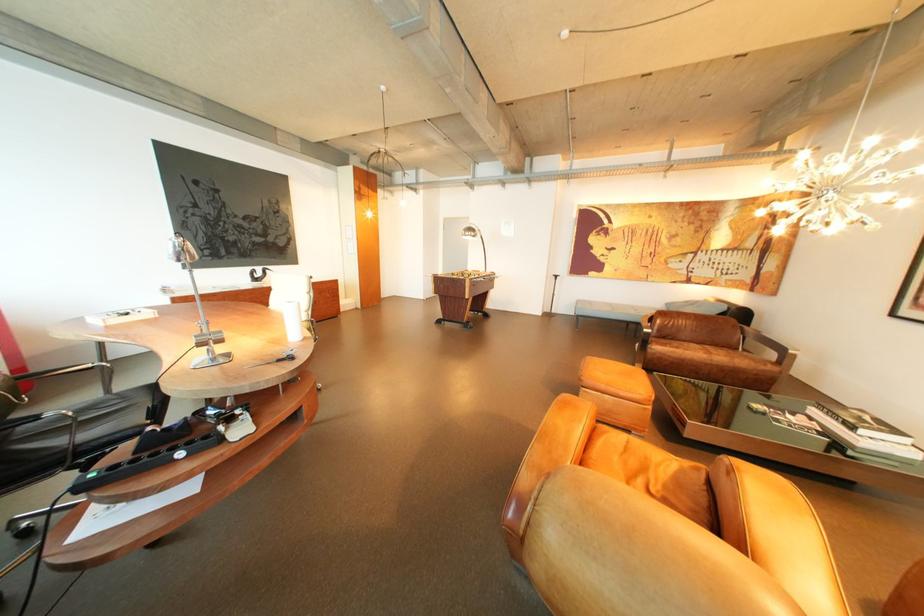
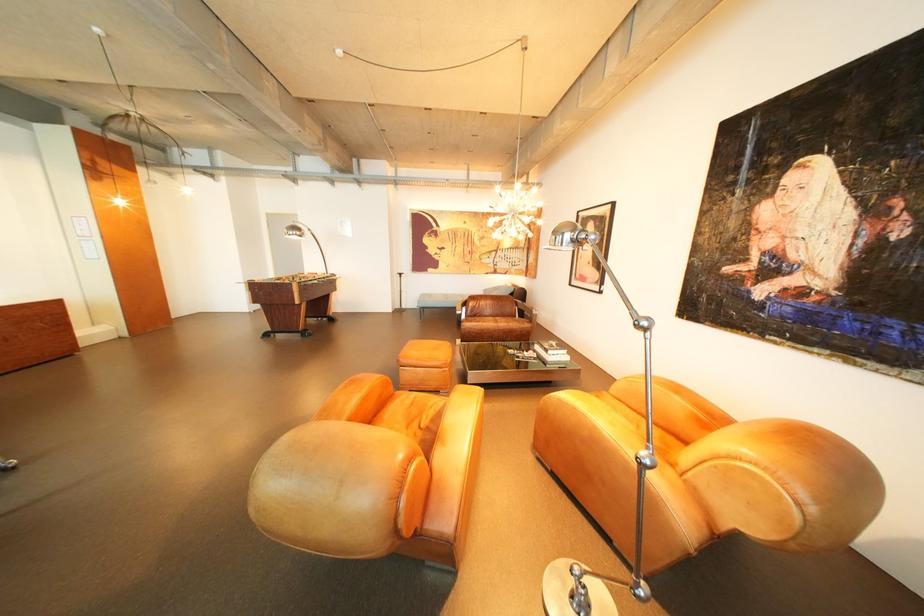
Where in the second image is the point corresponding to pixel 478 281 from the first image?

(304, 285)